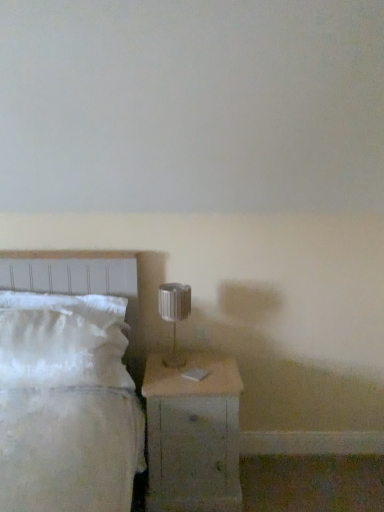
Question: Is white soft bed at left completely or partially outside of wooden nightstand at lower right?

Choices:
 (A) no
 (B) yes

Answer: (B)

Question: From a real-world perspective, is white soft bed at left physically above wooden nightstand at lower right?

Choices:
 (A) yes
 (B) no

Answer: (A)

Question: Can you confirm if white soft bed at left is shorter than wooden nightstand at lower right?

Choices:
 (A) no
 (B) yes

Answer: (A)

Question: From the image's perspective, is white soft bed at left above wooden nightstand at lower right?

Choices:
 (A) no
 (B) yes

Answer: (B)

Question: Can you confirm if white soft bed at left is positioned to the left of wooden nightstand at lower right?

Choices:
 (A) yes
 (B) no

Answer: (A)

Question: Is point 8,281 positioned closer to the camera than point 193,481?

Choices:
 (A) closer
 (B) farther

Answer: (B)

Question: Considering the positions of white soft bed at left and wooden nightstand at lower right in the image, is white soft bed at left bigger or smaller than wooden nightstand at lower right?

Choices:
 (A) small
 (B) big

Answer: (B)

Question: Visually, is white soft bed at left positioned to the left or to the right of wooden nightstand at lower right?

Choices:
 (A) left
 (B) right

Answer: (A)

Question: Is white soft bed at left inside or outside of wooden nightstand at lower right?

Choices:
 (A) outside
 (B) inside

Answer: (A)

Question: From a real-world perspective, relative to white fluffy pillow at left, is wooden nightstand at lower right vertically above or below?

Choices:
 (A) below
 (B) above

Answer: (A)

Question: Based on their sizes in the image, would you say wooden nightstand at lower right is bigger or smaller than white fluffy pillow at left?

Choices:
 (A) big
 (B) small

Answer: (A)

Question: Is point (160, 377) positioned closer to the camera than point (33, 379)?

Choices:
 (A) closer
 (B) farther

Answer: (B)

Question: From their relative heights in the image, would you say wooden nightstand at lower right is taller or shorter than white fluffy pillow at left?

Choices:
 (A) tall
 (B) short

Answer: (A)

Question: Does point (170, 317) appear closer or farther from the camera than point (39, 384)?

Choices:
 (A) farther
 (B) closer

Answer: (A)

Question: From their relative heights in the image, would you say metallic silver table lamp at center is taller or shorter than white fluffy pillow at left?

Choices:
 (A) short
 (B) tall

Answer: (A)